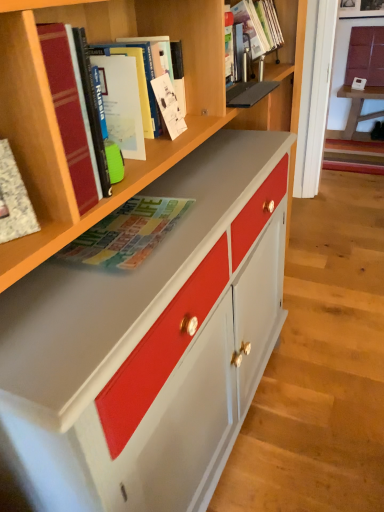
Identify the location of vacant point above matte white cabinet at upper right (from a real-world perspective). The image size is (384, 512). (372, 19).